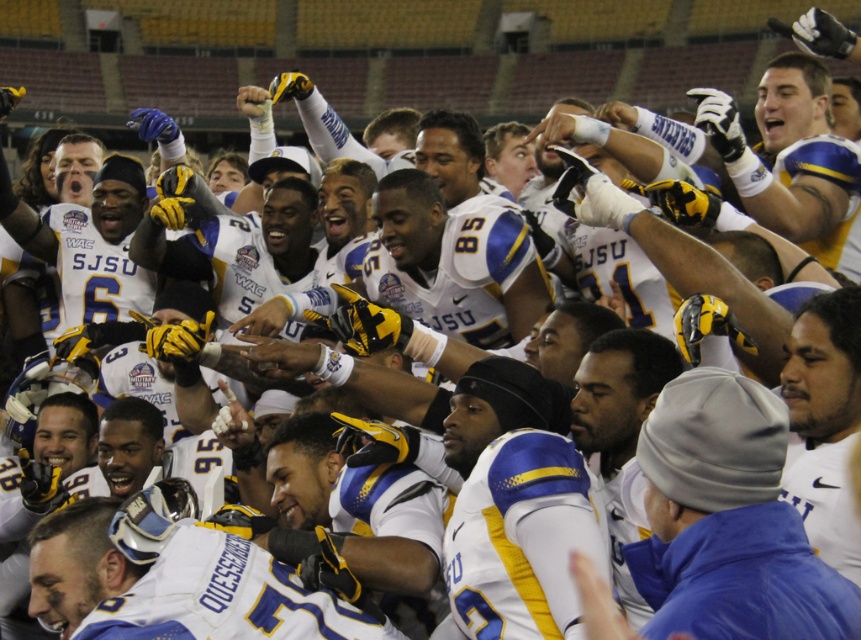
Question: Where is white matte jersey at center located in relation to matte blue jersey at upper right in the image?

Choices:
 (A) right
 (B) left

Answer: (B)

Question: Which object appears farthest from the camera in this image?

Choices:
 (A) white matte jersey at center
 (B) matte blue jersey at upper right

Answer: (B)

Question: Which object appears farthest from the camera in this image?

Choices:
 (A) white matte jersey at center
 (B) matte blue jersey at upper right

Answer: (B)

Question: Does white matte jersey at center have a smaller size compared to matte blue jersey at upper right?

Choices:
 (A) yes
 (B) no

Answer: (A)

Question: Does white matte jersey at center lie behind matte blue jersey at upper right?

Choices:
 (A) yes
 (B) no

Answer: (B)